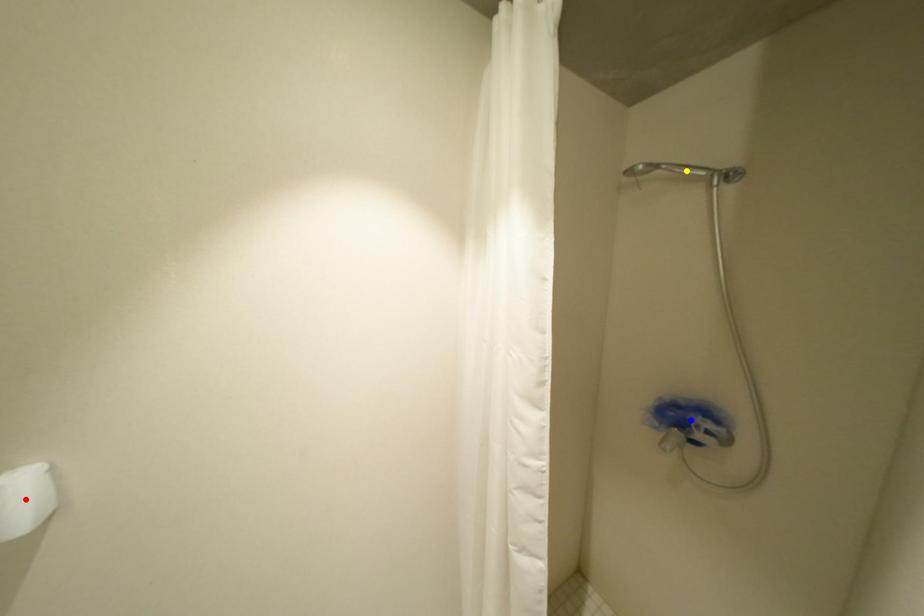
Order these from nearest to farthest:
yellow point, blue point, red point

red point → yellow point → blue point